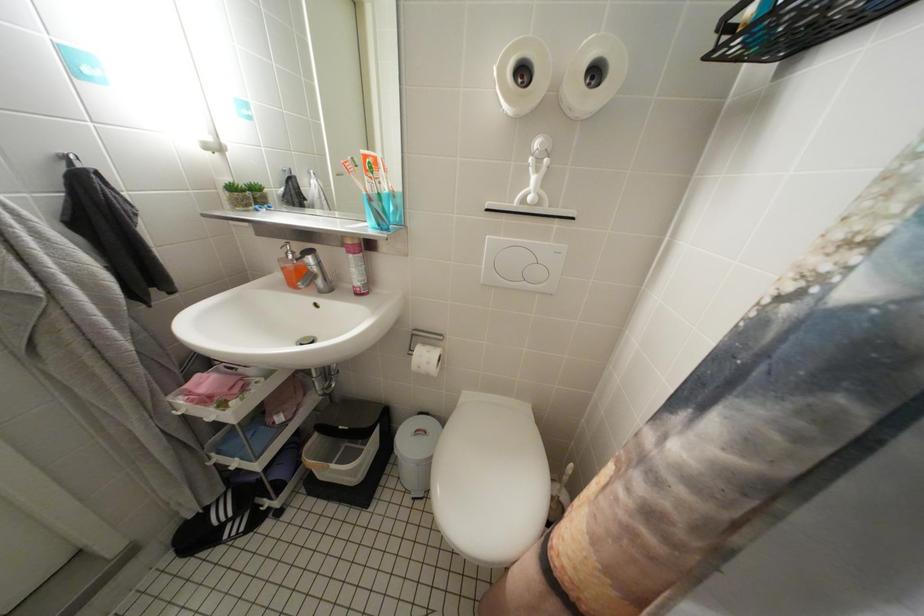
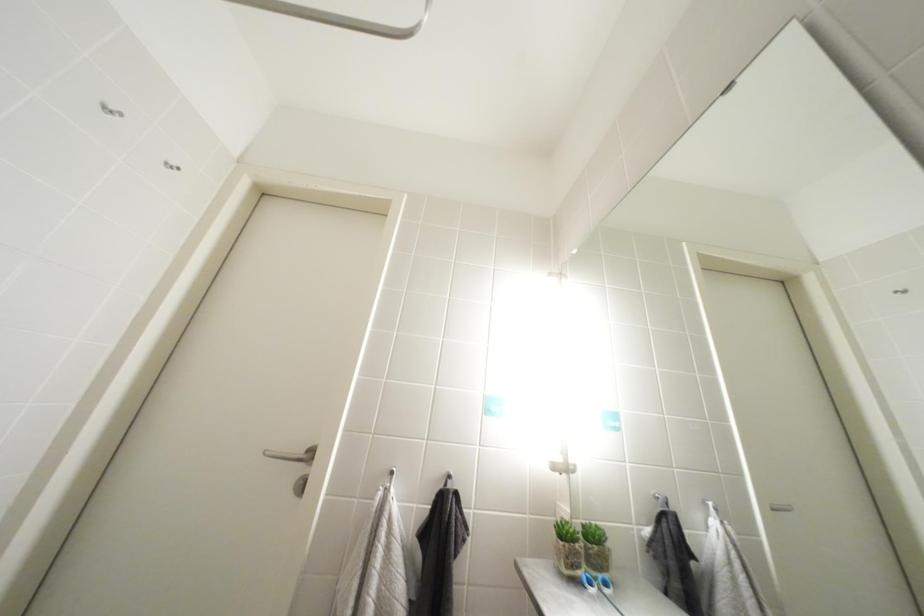
The first image is from the beginning of the video and the second image is from the end. How did the camera likely rotate when shooting the video?

The camera rotated toward left-up.